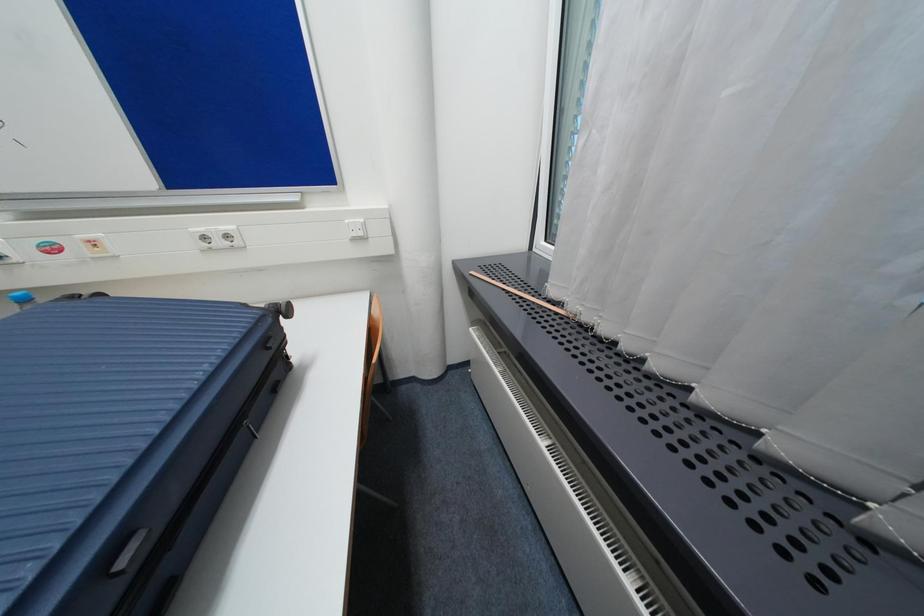
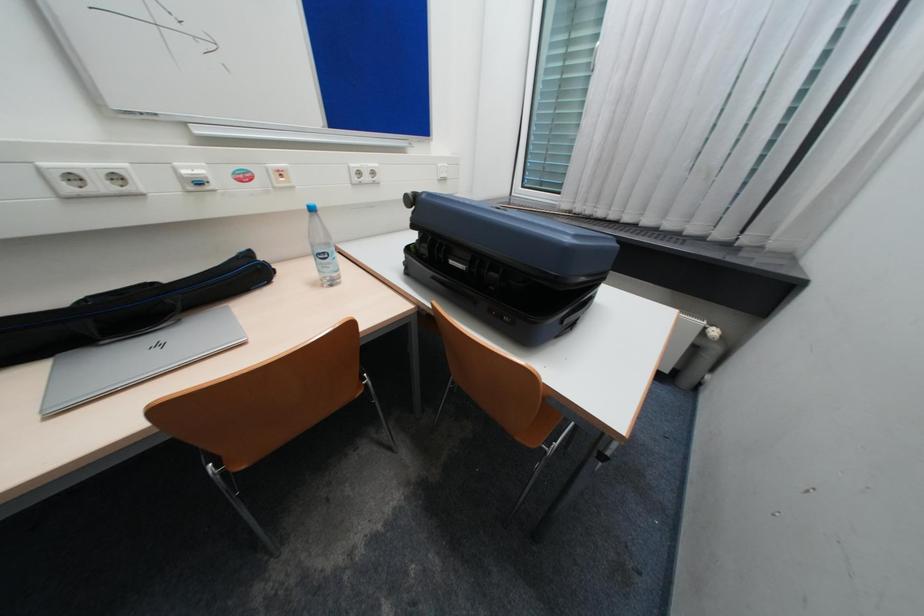
Question: Which direction would the cameraman need to move to produce the second image? Reply with the corresponding letter.

Choices:
 (A) Left
 (B) Right
 (C) Forward
 (D) Backward

Answer: (A)